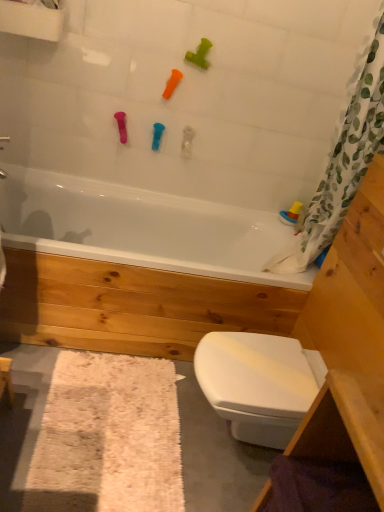
Question: Which direction should I rotate to look at green rubber toy at upper center, the 2th toy viewed from the right?

Choices:
 (A) left
 (B) right

Answer: (B)

Question: Is blue rubber toy at upper center, arranged as the fourth toy when viewed from the right, smaller than white glossy bathtub at center?

Choices:
 (A) yes
 (B) no

Answer: (A)

Question: Is white glossy bathtub at center a part of blue rubber toy at upper center, the first toy from the left?

Choices:
 (A) yes
 (B) no

Answer: (B)

Question: From a real-world perspective, is blue rubber toy at upper center, the first toy from the left, on top of white glossy bathtub at center?

Choices:
 (A) no
 (B) yes

Answer: (B)

Question: Can you confirm if blue rubber toy at upper center, arranged as the fourth toy when viewed from the right, is wider than white glossy bathtub at center?

Choices:
 (A) yes
 (B) no

Answer: (B)

Question: From the image's perspective, is blue rubber toy at upper center, marked as the second toy in a bottom-to-top arrangement, beneath white glossy bathtub at center?

Choices:
 (A) no
 (B) yes

Answer: (A)

Question: From a real-world perspective, is blue rubber toy at upper center, marked as the second toy in a bottom-to-top arrangement, under white glossy bathtub at center?

Choices:
 (A) no
 (B) yes

Answer: (A)

Question: Is white glossy bathtub at center to the right of white shaggy bath mat at lower left from the viewer's perspective?

Choices:
 (A) yes
 (B) no

Answer: (A)

Question: Is white glossy bathtub at center positioned with its back to white shaggy bath mat at lower left?

Choices:
 (A) yes
 (B) no

Answer: (B)

Question: Is white glossy bathtub at center next to white shaggy bath mat at lower left and touching it?

Choices:
 (A) yes
 (B) no

Answer: (B)

Question: From a real-world perspective, is white glossy bathtub at center below white shaggy bath mat at lower left?

Choices:
 (A) yes
 (B) no

Answer: (B)

Question: Is white glossy bathtub at center positioned in front of white shaggy bath mat at lower left?

Choices:
 (A) no
 (B) yes

Answer: (A)

Question: Could you tell me if white glossy bathtub at center is turned towards white shaggy bath mat at lower left?

Choices:
 (A) no
 (B) yes

Answer: (B)

Question: Is green rubber toy at upper center, the 2th toy viewed from the right, shorter than white glossy bathtub at center?

Choices:
 (A) no
 (B) yes

Answer: (B)